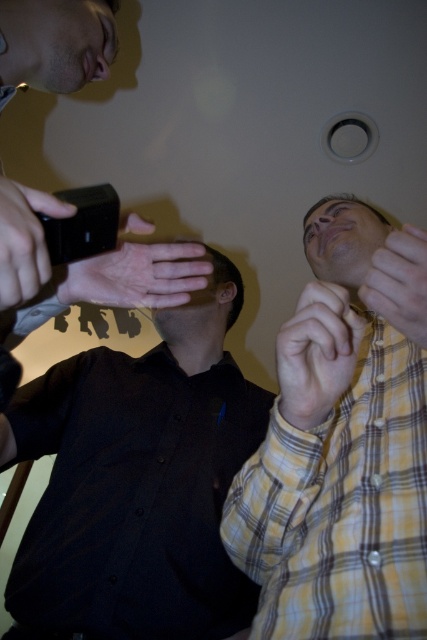
Question: Considering the relative positions of black matte shirt at left and black matte phone at upper left in the image provided, where is black matte shirt at left located with respect to black matte phone at upper left?

Choices:
 (A) below
 (B) above

Answer: (A)

Question: Which of these objects is positioned farthest from the black matte phone at upper left?

Choices:
 (A) black matte shirt at left
 (B) yellow plaid shirt at lower right

Answer: (A)

Question: Which point is closer to the camera taking this photo?

Choices:
 (A) (373, 600)
 (B) (43, 317)

Answer: (A)

Question: Is black matte shirt at left thinner than yellow plaid shirt at lower right?

Choices:
 (A) yes
 (B) no

Answer: (B)

Question: Which point is closer to the camera?

Choices:
 (A) tap(148, 401)
 (B) tap(5, 273)
 (C) tap(289, 604)

Answer: (B)

Question: Is black matte shirt at left bigger than yellow plaid shirt at lower right?

Choices:
 (A) yes
 (B) no

Answer: (A)